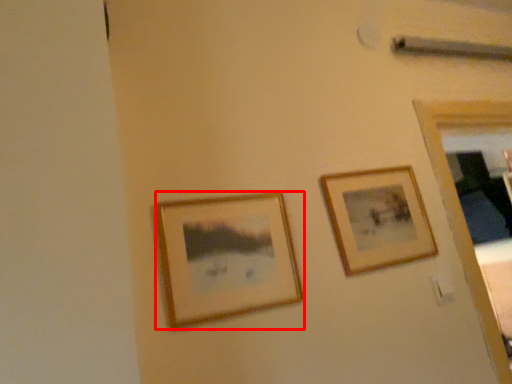
Question: Where is picture frame (annotated by the red box) located in relation to picture frame in the image?

Choices:
 (A) right
 (B) left

Answer: (B)